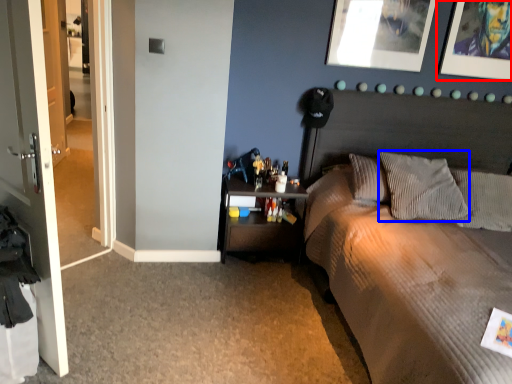
Question: Which of the following is the farthest to the observer, picture frame (highlighted by a red box) or pillow (highlighted by a blue box)?

Choices:
 (A) picture frame
 (B) pillow

Answer: (A)